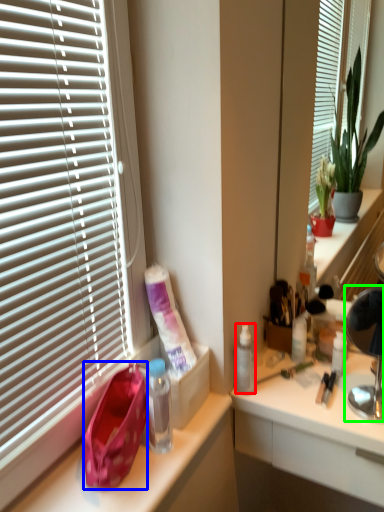
Question: Which is nearer to the bottle (highlighted by a red box)? handbag (highlighted by a blue box) or lamp (highlighted by a green box).

Choices:
 (A) handbag
 (B) lamp

Answer: (B)